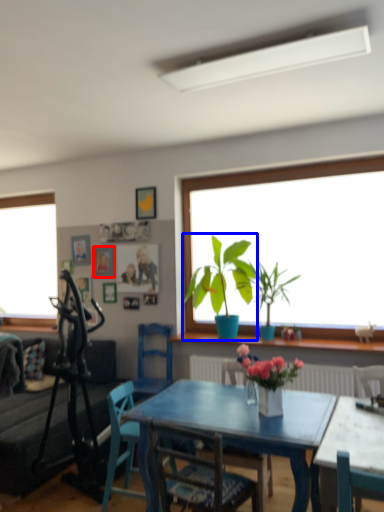
Question: Among these objects, which one is nearest to the camera, picture frame (highlighted by a red box) or houseplant (highlighted by a blue box)?

Choices:
 (A) picture frame
 (B) houseplant

Answer: (B)